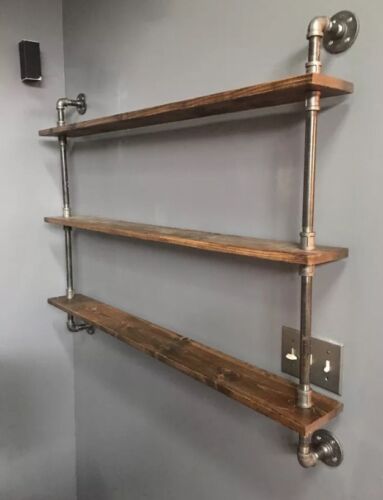
The height and width of the screenshot is (500, 383). What are the coordinates of `shelf` in the screenshot? It's located at (233, 373), (231, 243), (207, 106).